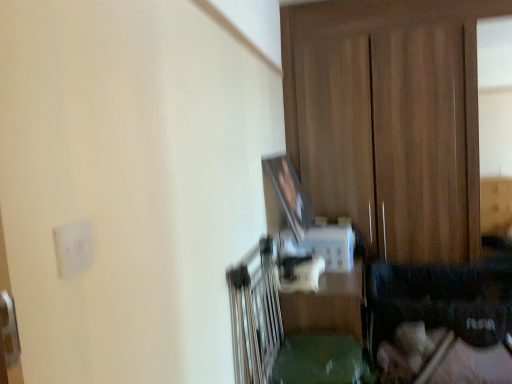
Question: Is wooden dresser at center at the left side of green plastic table at center?

Choices:
 (A) yes
 (B) no

Answer: (B)

Question: Is wooden dresser at center oriented towards green plastic table at center?

Choices:
 (A) yes
 (B) no

Answer: (A)

Question: Is wooden dresser at center outside green plastic table at center?

Choices:
 (A) yes
 (B) no

Answer: (A)

Question: Is wooden dresser at center facing away from green plastic table at center?

Choices:
 (A) no
 (B) yes

Answer: (A)

Question: Can you confirm if wooden dresser at center is taller than green plastic table at center?

Choices:
 (A) yes
 (B) no

Answer: (A)

Question: Does wooden dresser at center have a smaller size compared to green plastic table at center?

Choices:
 (A) yes
 (B) no

Answer: (B)

Question: Is wooden dresser at center positioned beyond the bounds of white matte electric outlet at upper left?

Choices:
 (A) no
 (B) yes

Answer: (B)

Question: Is the depth of wooden dresser at center greater than that of white matte electric outlet at upper left?

Choices:
 (A) yes
 (B) no

Answer: (A)

Question: Is wooden dresser at center taller than white matte electric outlet at upper left?

Choices:
 (A) no
 (B) yes

Answer: (B)

Question: Would you say wooden dresser at center contains white matte electric outlet at upper left?

Choices:
 (A) no
 (B) yes

Answer: (A)

Question: Considering the relative sizes of wooden dresser at center and white matte electric outlet at upper left in the image provided, is wooden dresser at center shorter than white matte electric outlet at upper left?

Choices:
 (A) yes
 (B) no

Answer: (B)

Question: Is wooden dresser at center directly adjacent to white matte electric outlet at upper left?

Choices:
 (A) no
 (B) yes

Answer: (A)

Question: Does white matte electric outlet at upper left appear on the left side of wooden dresser at center?

Choices:
 (A) no
 (B) yes

Answer: (B)